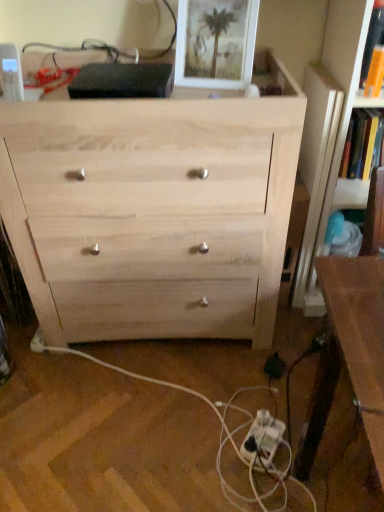
I want to click on free space on the front side of black plastic electric outlet at lower right, so click(275, 404).